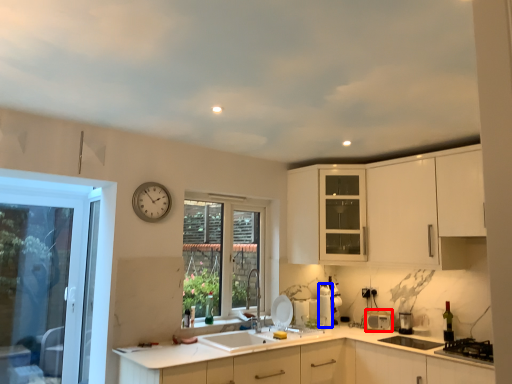
Question: Which object is further to the camera taking this photo, appliance (highlighted by a red box) or appliance (highlighted by a blue box)?

Choices:
 (A) appliance
 (B) appliance

Answer: (B)